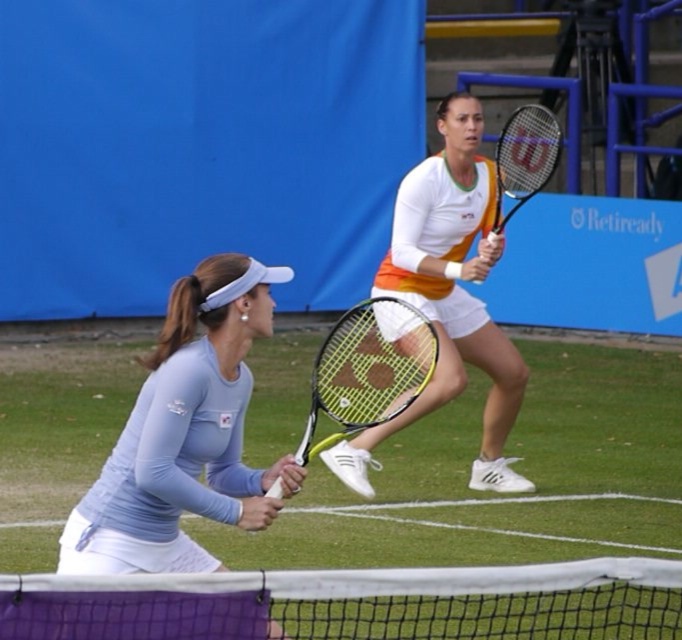
You are a tennis coach analyzing the players during a match. You notice the matte blue tennis racket at left and the white tennis racket with orange accents at right. Based on their positions, which racket is closer to the point marked at coordinates (183, 435)?

The matte blue tennis racket at left is located at point (183, 435), so it is exactly at that coordinate and therefore closer than the white tennis racket with orange accents at right.

You are a tennis coach analyzing the players during a match. You notice two points marked on the court. Which point, point (256,310) or point (458,244), is closer to the front of the court where the net is located?

Point (256,310) is closer to the viewer than point (458,244), so it is closer to the front of the court where the net is located.